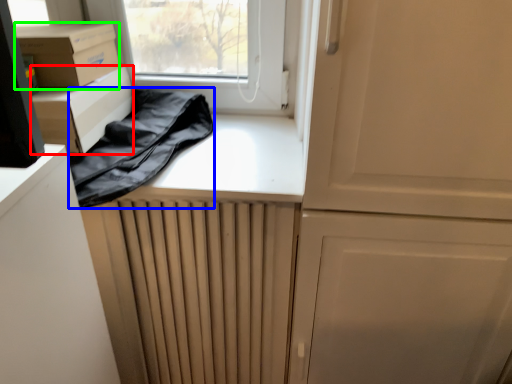
Question: Which is farther away from cardboard box (highlighted by a red box)? clothing (highlighted by a blue box) or cardboard box (highlighted by a green box)?

Choices:
 (A) clothing
 (B) cardboard box

Answer: (A)